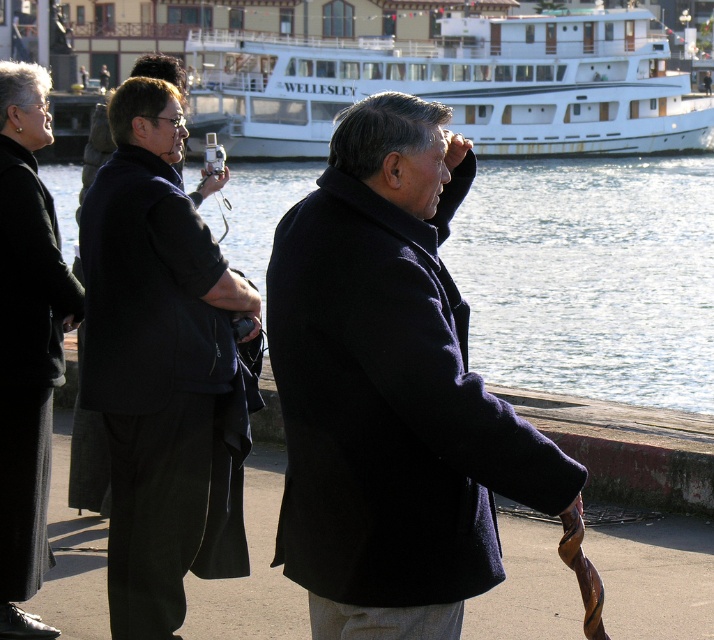
Who is positioned more to the right, clear water at center or black matte coat at center?

black matte coat at center

Is clear water at center wider than black matte coat at center?

Correct, the width of clear water at center exceeds that of black matte coat at center.

At what (x,y) coordinates should I click in order to perform the action: click on clear water at center. Please return your answer as a coordinate pair (x, y). This screenshot has width=714, height=640. Looking at the image, I should click on (590, 276).

At what (x,y) coordinates should I click in order to perform the action: click on clear water at center. Please return your answer as a coordinate pair (x, y). This screenshot has width=714, height=640. Looking at the image, I should click on (590, 276).

Who is shorter, matte black coat at center or white glossy ship at upper center?

With less height is matte black coat at center.

Which is behind, point (402, 516) or point (643, 20)?

Point (643, 20)

Identify the location of matte black coat at center. This screenshot has width=714, height=640. (391, 388).

Can you confirm if black matte coat at center is positioned to the right of black wool coat at left?

Yes, black matte coat at center is to the right of black wool coat at left.

Which is above, black matte coat at center or black wool coat at left?

black wool coat at left is higher up.

This screenshot has height=640, width=714. I want to click on black matte coat at center, so click(159, 368).